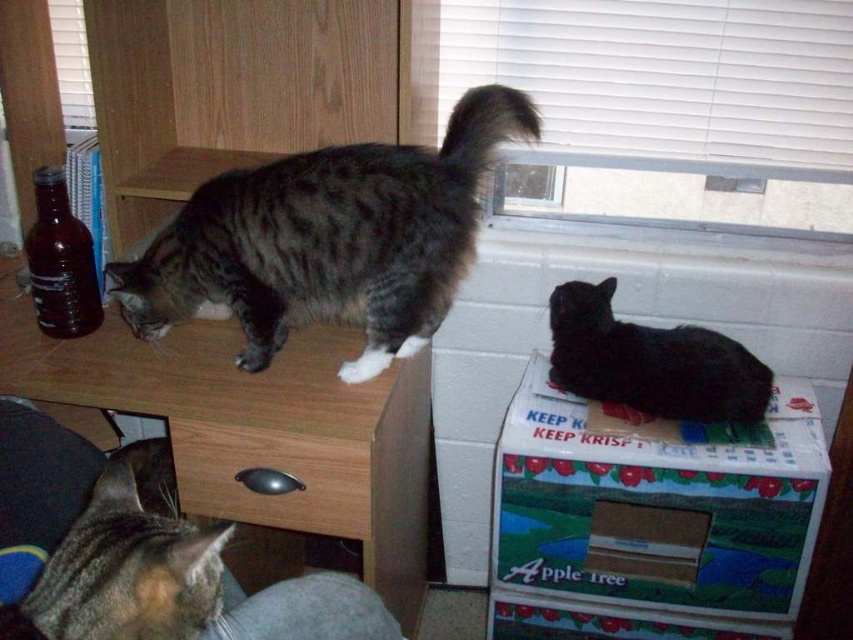
Can you confirm if cardboard box at lower right is smaller than tabby fur cat at lower left?

No.

Does cardboard box at lower right have a larger size compared to tabby fur cat at lower left?

Yes.

Does point (578, 497) come closer to viewer compared to point (119, 604)?

No, (578, 497) is behind (119, 604).

Where is `cardboard box at lower right`? cardboard box at lower right is located at coordinates (657, 512).

Can you confirm if wooden at left is thinner than tabby fur cat at lower left?

No.

Does point (15, 316) come farther from viewer compared to point (154, 438)?

No, it is not.

Identify the location of wooden at left. (253, 435).

Who is lower down, cardboard box at lower right or tabby fur cat at upper left?

Positioned lower is cardboard box at lower right.

Does cardboard box at lower right come behind tabby fur cat at upper left?

That is True.

Where is `cardboard box at lower right`? The image size is (853, 640). cardboard box at lower right is located at coordinates (657, 512).